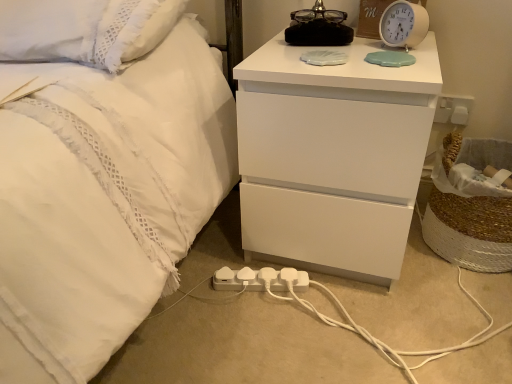
The image size is (512, 384). I want to click on spots to the right of white plastic extension cord at lower center, so click(329, 302).